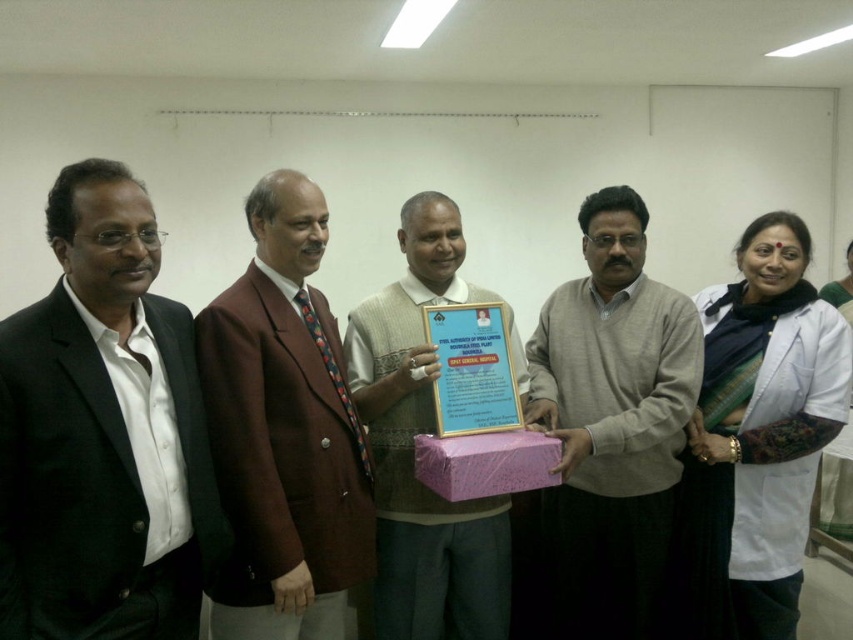
Does point (346, 502) come closer to viewer compared to point (526, 465)?

Yes, point (346, 502) is closer to viewer.

Is point (322, 496) farther from viewer compared to point (525, 465)?

No, (322, 496) is in front of (525, 465).

Where is `brown woolen blazer at center`? The width and height of the screenshot is (853, 640). brown woolen blazer at center is located at coordinates (283, 432).

How much distance is there between brown woolen blazer at center and matte brown vest at center?

brown woolen blazer at center is 10.89 inches away from matte brown vest at center.

From the picture: Which of these two, brown woolen blazer at center or matte brown vest at center, stands taller?

Standing taller between the two is matte brown vest at center.

At what (x,y) coordinates should I click in order to perform the action: click on brown woolen blazer at center. Please return your answer as a coordinate pair (x, y). This screenshot has width=853, height=640. Looking at the image, I should click on (283, 432).

Can you confirm if black matte suit at left is positioned to the left of pink paper box at center?

Correct, you'll find black matte suit at left to the left of pink paper box at center.

From the picture: Which is above, black matte suit at left or pink paper box at center?

black matte suit at left is above.

What do you see at coordinates (103, 433) in the screenshot? Image resolution: width=853 pixels, height=640 pixels. I see `black matte suit at left` at bounding box center [103, 433].

Locate an element on the screen. black matte suit at left is located at coordinates (103, 433).